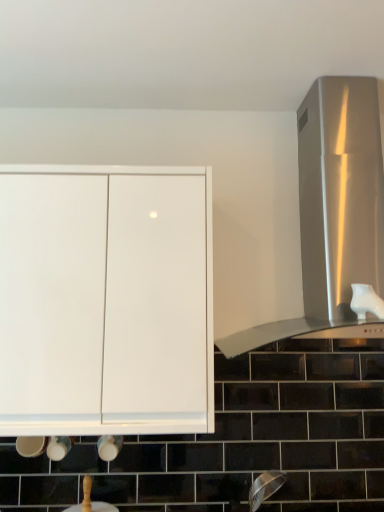
Question: Should I look upward or downward to see white glossy cabinet at upper left?

Choices:
 (A) up
 (B) down

Answer: (B)

Question: Is white glossy cabinet at upper left smaller than white glossy sink at lower center?

Choices:
 (A) no
 (B) yes

Answer: (A)

Question: Is white glossy cabinet at upper left outside white glossy sink at lower center?

Choices:
 (A) yes
 (B) no

Answer: (A)

Question: Is white glossy cabinet at upper left looking in the opposite direction of white glossy sink at lower center?

Choices:
 (A) yes
 (B) no

Answer: (B)

Question: Is white glossy cabinet at upper left not close to white glossy sink at lower center?

Choices:
 (A) yes
 (B) no

Answer: (B)

Question: Is white glossy cabinet at upper left further to the viewer compared to white glossy sink at lower center?

Choices:
 (A) yes
 (B) no

Answer: (B)

Question: From the image's perspective, is white glossy cabinet at upper left below white glossy sink at lower center?

Choices:
 (A) no
 (B) yes

Answer: (A)

Question: Is stainless steel vent at right far away from white glossy cabinet at upper left?

Choices:
 (A) yes
 (B) no

Answer: (B)

Question: Does stainless steel vent at right have a smaller size compared to white glossy cabinet at upper left?

Choices:
 (A) yes
 (B) no

Answer: (B)

Question: Considering the relative sizes of stainless steel vent at right and white glossy cabinet at upper left in the image provided, is stainless steel vent at right taller than white glossy cabinet at upper left?

Choices:
 (A) no
 (B) yes

Answer: (B)

Question: From a real-world perspective, is stainless steel vent at right on top of white glossy cabinet at upper left?

Choices:
 (A) no
 (B) yes

Answer: (B)

Question: Can we say stainless steel vent at right lies outside white glossy cabinet at upper left?

Choices:
 (A) yes
 (B) no

Answer: (A)

Question: From a real-world perspective, is stainless steel vent at right beneath white glossy cabinet at upper left?

Choices:
 (A) yes
 (B) no

Answer: (B)

Question: Does white glossy sink at lower center come behind white glossy cabinet at upper left?

Choices:
 (A) yes
 (B) no

Answer: (A)